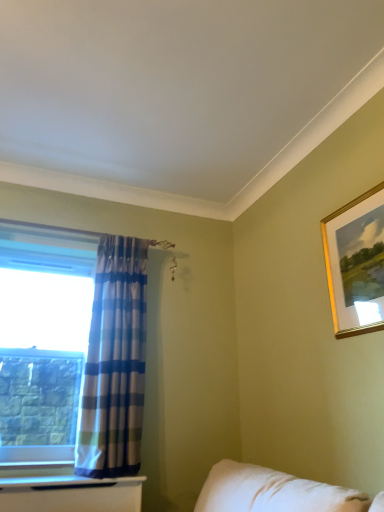
Question: Is clear glass window at left spatially inside gold-framed picture at upper right, or outside of it?

Choices:
 (A) inside
 (B) outside

Answer: (B)

Question: Is clear glass window at left in front of or behind gold-framed picture at upper right in the image?

Choices:
 (A) behind
 (B) front

Answer: (A)

Question: Estimate the real-world distances between objects in this image. Which object is farther from the blue plaid fabric curtain at left?

Choices:
 (A) clear glass window at left
 (B) gold-framed picture at upper right

Answer: (B)

Question: Considering the real-world distances, which object is closest to the blue plaid fabric curtain at left?

Choices:
 (A) clear glass window at left
 (B) gold-framed picture at upper right

Answer: (A)